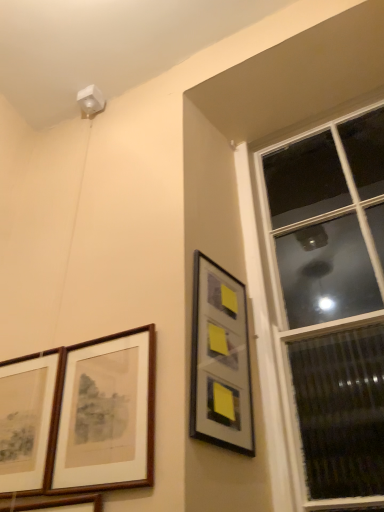
Question: From a real-world perspective, relative to brown wooden picture frame at lower left, the second picture frame positioned from the right, is transparent glass window at upper right vertically above or below?

Choices:
 (A) below
 (B) above

Answer: (B)

Question: Is point (316, 478) positioned closer to the camera than point (144, 381)?

Choices:
 (A) closer
 (B) farther

Answer: (B)

Question: Which is nearer to the transparent glass window at upper right?

Choices:
 (A) brown wooden picture frame at lower left, the second picture frame positioned from the right
 (B) wooden framed picture at lower left, the second picture frame positioned from the left
 (C) wooden picture frame at lower left, the fourth picture frame when ordered from right to left
 (D) metallic silver picture frame at upper right, the 1th picture frame in the right-to-left sequence

Answer: (D)

Question: Which of these objects is positioned closest to the metallic silver picture frame at upper right, the 1th picture frame in the right-to-left sequence?

Choices:
 (A) wooden framed picture at lower left, placed as the 3th picture frame when sorted from right to left
 (B) brown wooden picture frame at lower left, the third picture frame in the left-to-right sequence
 (C) wooden picture frame at lower left, the fourth picture frame when ordered from right to left
 (D) transparent glass window at upper right

Answer: (B)